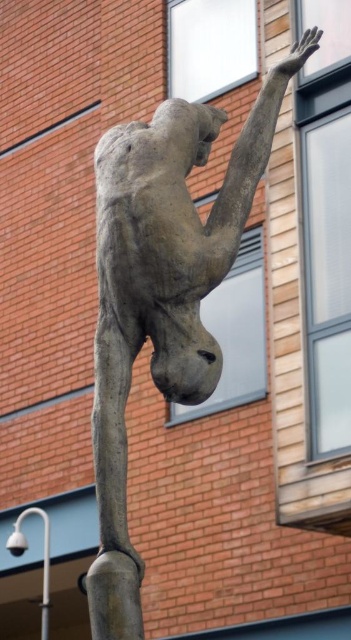
Question: Which point is farther from the camera taking this photo?

Choices:
 (A) (182, 282)
 (B) (21, 524)

Answer: (B)

Question: Does bronze statue at center come behind white metal pole at lower left?

Choices:
 (A) no
 (B) yes

Answer: (A)

Question: Which of the following is the farthest from the observer?

Choices:
 (A) (191, 109)
 (B) (43, 637)

Answer: (B)

Question: Does bronze statue at center appear on the left side of white metal pole at lower left?

Choices:
 (A) yes
 (B) no

Answer: (B)

Question: Is bronze statue at center bigger than white metal pole at lower left?

Choices:
 (A) no
 (B) yes

Answer: (B)